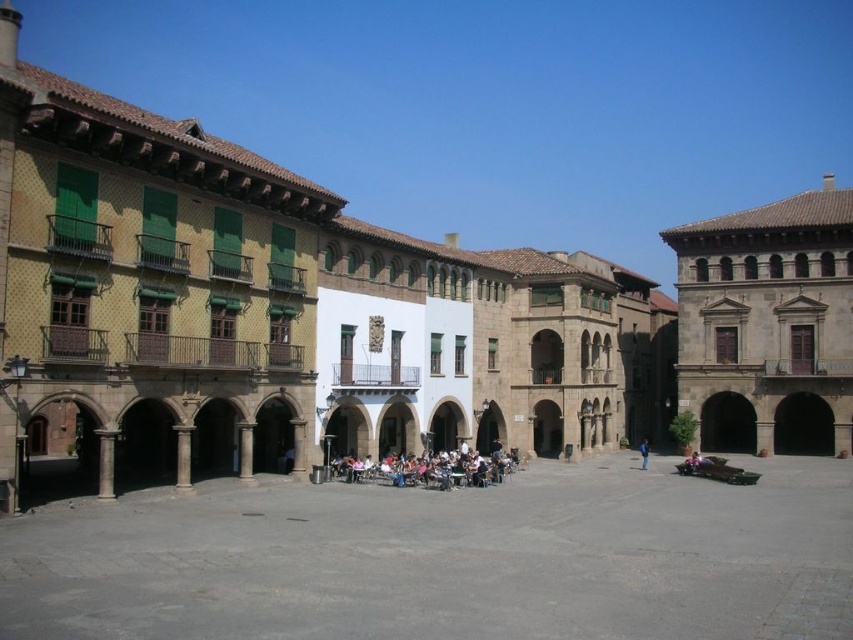
Question: Is smooth stone column at left wider than blue fabric person at center?

Choices:
 (A) no
 (B) yes

Answer: (A)

Question: Among these objects, which one is nearest to the camera?

Choices:
 (A) smooth stone column at left
 (B) white stone pillar at center
 (C) stone column at center
 (D) blue fabric person at center

Answer: (A)

Question: In this image, where is gray stone courtyard at center located relative to matte white chairs at center?

Choices:
 (A) above
 (B) below

Answer: (A)

Question: Which is farther from the smooth stone column at left?

Choices:
 (A) blue fabric person at center
 (B) white stone pillar at center
 (C) matte stone pillar at center
 (D) stone column at center

Answer: (A)

Question: Does gray stone courtyard at center appear under blue fabric person at center?

Choices:
 (A) yes
 (B) no

Answer: (B)

Question: Which object appears farthest from the camera in this image?

Choices:
 (A) stone column at center
 (B) smooth stone column at left

Answer: (A)